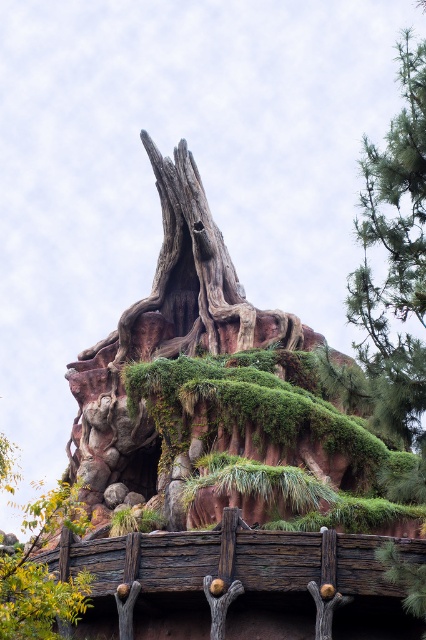
Question: Is wooden rail at lower center thinner than green mossy tree at lower left?

Choices:
 (A) yes
 (B) no

Answer: (A)

Question: Is wooden rail at lower center smaller than green mossy tree at lower left?

Choices:
 (A) no
 (B) yes

Answer: (B)

Question: Does wooden rail at lower center appear under green mossy tree at lower left?

Choices:
 (A) no
 (B) yes

Answer: (A)

Question: Which point appears closest to the camera in this image?

Choices:
 (A) (54, 616)
 (B) (322, 600)

Answer: (A)